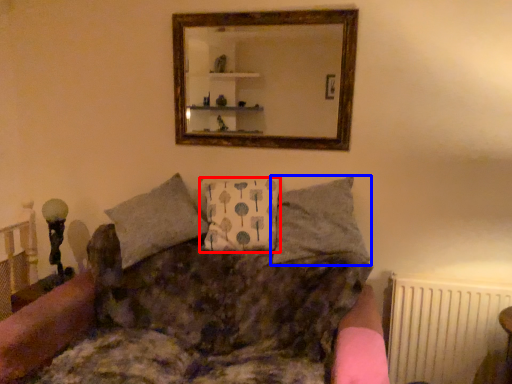
Question: Which object is further to the camera taking this photo, pillow (highlighted by a red box) or pillow (highlighted by a blue box)?

Choices:
 (A) pillow
 (B) pillow

Answer: (A)